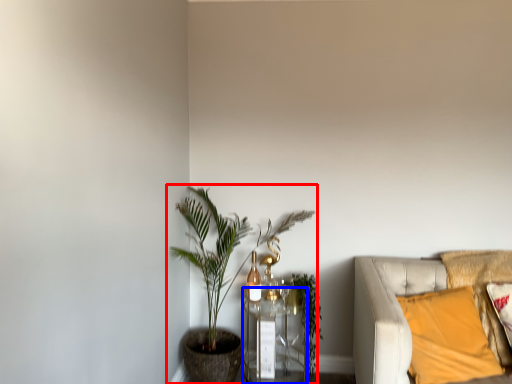
Question: Which of the following is the farthest to the observer, houseplant (highlighted by a red box) or table (highlighted by a blue box)?

Choices:
 (A) houseplant
 (B) table

Answer: (B)